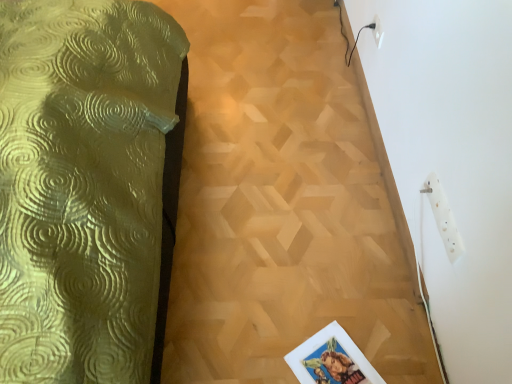
Question: From a real-world perspective, is wooden parquet floor at center below white plastic electric outlet at upper right, the 2th electric outlet viewed from the front?

Choices:
 (A) no
 (B) yes

Answer: (B)

Question: From the image's perspective, would you say wooden parquet floor at center is positioned over white plastic electric outlet at upper right, which is the first electric outlet in back-to-front order?

Choices:
 (A) yes
 (B) no

Answer: (B)

Question: Is white plastic electric outlet at upper right, which is counted as the 1th electric outlet, starting from the top, a part of wooden parquet floor at center?

Choices:
 (A) no
 (B) yes

Answer: (A)

Question: Can you confirm if wooden parquet floor at center is positioned to the right of white plastic electric outlet at upper right, the 2th electric outlet viewed from the front?

Choices:
 (A) no
 (B) yes

Answer: (A)

Question: From the image's perspective, is wooden parquet floor at center located beneath white plastic electric outlet at upper right, which appears as the 1th electric outlet when viewed from the left?

Choices:
 (A) no
 (B) yes

Answer: (B)

Question: From a real-world perspective, is wooden parquet floor at center on white plastic electric outlet at upper right, which appears as the 1th electric outlet when viewed from the left?

Choices:
 (A) no
 (B) yes

Answer: (A)

Question: From the image's perspective, is white plastic electric outlet at upper right, which appears as the 1th electric outlet when viewed from the left, located above white plastic socket at upper right, the 1th electric outlet in the bottom-to-top sequence?

Choices:
 (A) no
 (B) yes

Answer: (B)

Question: From a real-world perspective, is white plastic electric outlet at upper right, which appears as the 1th electric outlet when viewed from the left, on white plastic socket at upper right, the 2th electric outlet from the back?

Choices:
 (A) no
 (B) yes

Answer: (B)

Question: Is white plastic electric outlet at upper right, which is counted as the 1th electric outlet, starting from the top, oriented away from white plastic socket at upper right, placed as the second electric outlet when sorted from left to right?

Choices:
 (A) yes
 (B) no

Answer: (B)

Question: Is white plastic electric outlet at upper right, the second electric outlet ordered from the bottom, not close to white plastic socket at upper right, the 1th electric outlet in the front-to-back sequence?

Choices:
 (A) yes
 (B) no

Answer: (B)

Question: Does white plastic electric outlet at upper right, the second electric outlet ordered from the bottom, turn towards white plastic socket at upper right, acting as the 2th electric outlet starting from the top?

Choices:
 (A) yes
 (B) no

Answer: (B)

Question: Is white plastic electric outlet at upper right, the second electric outlet in the right-to-left sequence, at the left side of white plastic socket at upper right, the 1th electric outlet in the bottom-to-top sequence?

Choices:
 (A) no
 (B) yes

Answer: (B)

Question: Is white plastic electric outlet at upper right, the second electric outlet ordered from the bottom, at the back of white plastic socket at upper right, acting as the 2th electric outlet starting from the top?

Choices:
 (A) yes
 (B) no

Answer: (B)